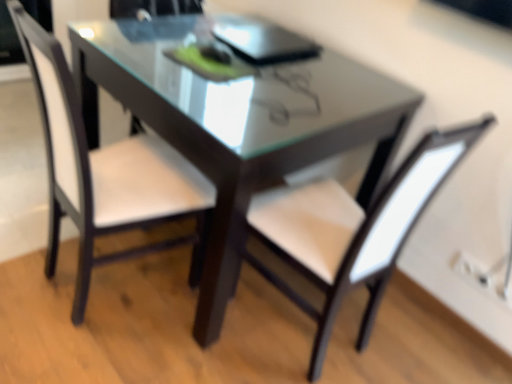
This screenshot has height=384, width=512. Find the location of `vacant area that is situated to the right of white leather chair at center, marked as the 2th chair in a left-to-right arrangement`. vacant area that is situated to the right of white leather chair at center, marked as the 2th chair in a left-to-right arrangement is located at coordinates (402, 337).